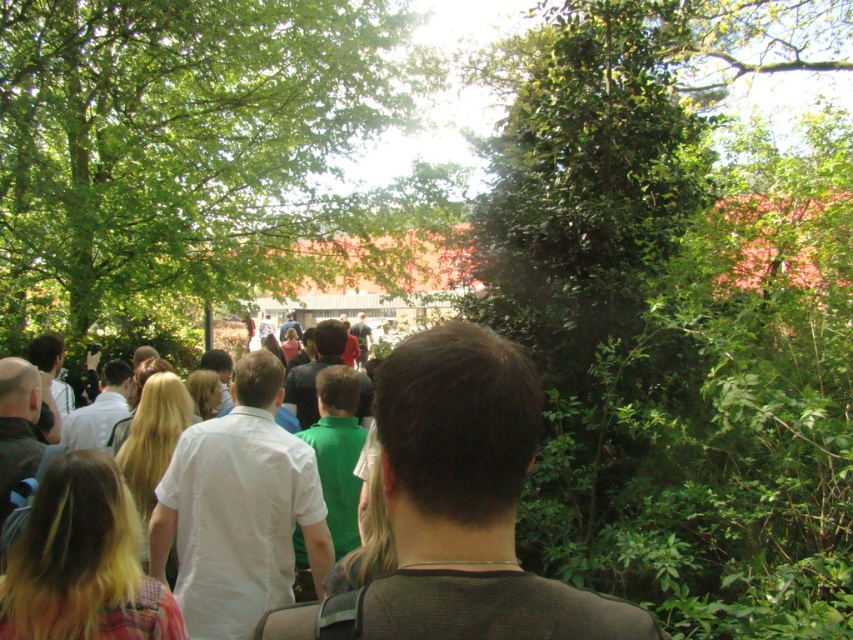
You are a photographer trying to capture a clear shot of the white shirt at center and the white cotton shirt at center in the crowd. Which one is partially hidden by the other?

The white shirt at center is positioned over the white cotton shirt at center, so the white cotton shirt at center is partially hidden by the white shirt at center.

You are standing in the park and see the point at coordinates [195,157]. What object does this point correspond to?

The point at coordinates [195,157] corresponds to the green leafy tree at center.